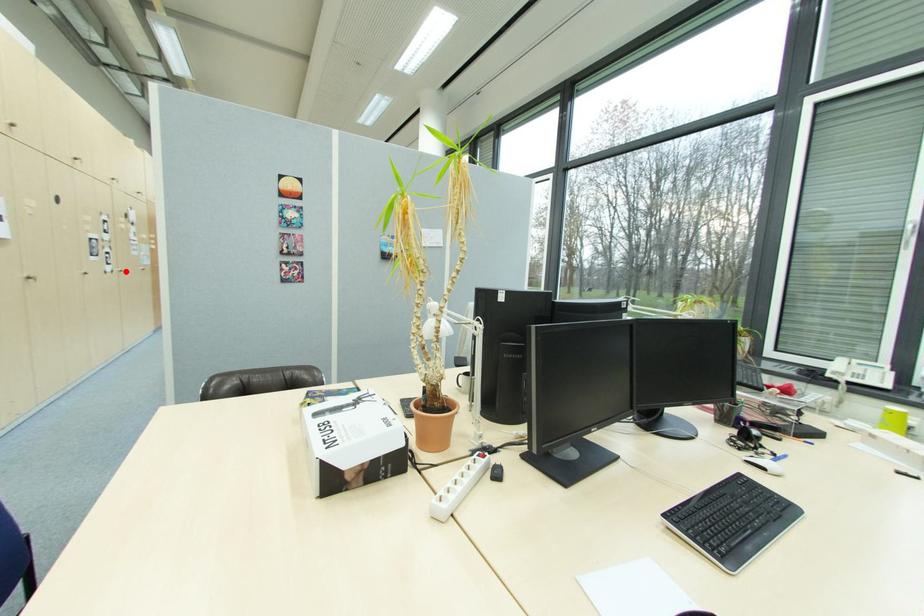
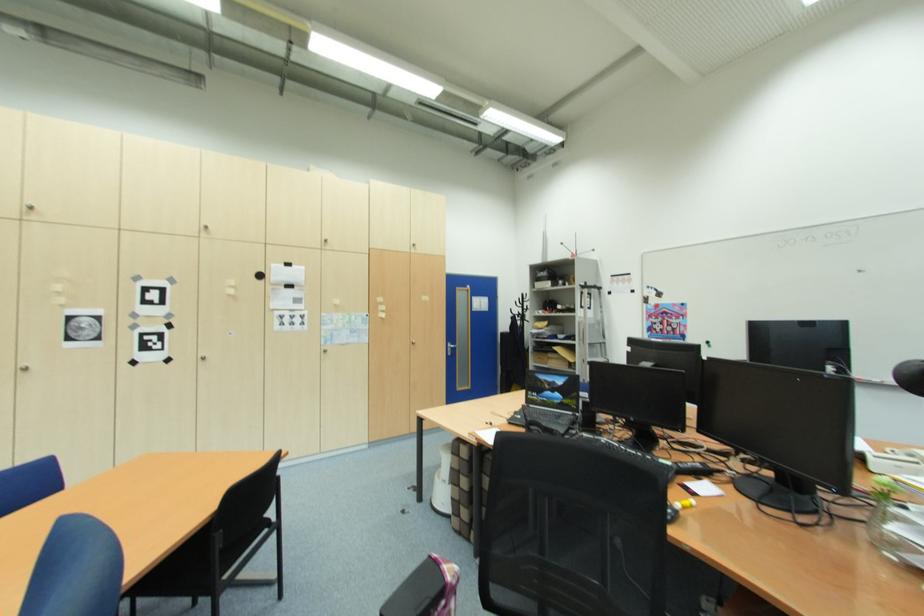
Question: I am providing you with two images of the same scene from different viewpoints. A red point is marked on the first image. Is the red point's position out of view in image 2?

Choices:
 (A) Yes
 (B) No

Answer: (B)